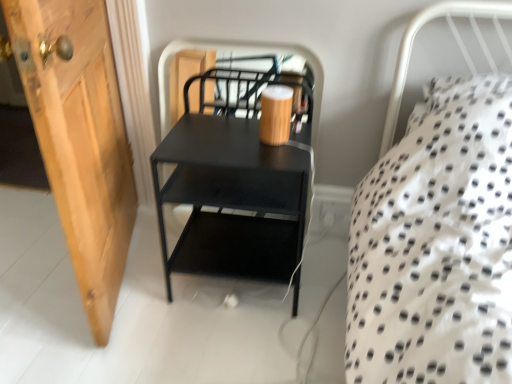
Question: Considering the relative positions of wooden door at left and black matte nightstand at center in the image provided, is wooden door at left to the left or to the right of black matte nightstand at center?

Choices:
 (A) left
 (B) right

Answer: (A)

Question: In terms of width, does wooden door at left look wider or thinner when compared to black matte nightstand at center?

Choices:
 (A) wide
 (B) thin

Answer: (A)

Question: Would you say wooden door at left is inside or outside black matte nightstand at center?

Choices:
 (A) inside
 (B) outside

Answer: (B)

Question: Considering the positions of point (207, 160) and point (92, 34), is point (207, 160) closer or farther from the camera than point (92, 34)?

Choices:
 (A) closer
 (B) farther

Answer: (A)

Question: Is black matte nightstand at center bigger or smaller than wooden door at left?

Choices:
 (A) small
 (B) big

Answer: (B)

Question: Do you think black matte nightstand at center is within wooden door at left, or outside of it?

Choices:
 (A) outside
 (B) inside

Answer: (A)

Question: From the image's perspective, is black matte nightstand at center located above or below wooden door at left?

Choices:
 (A) below
 (B) above

Answer: (A)